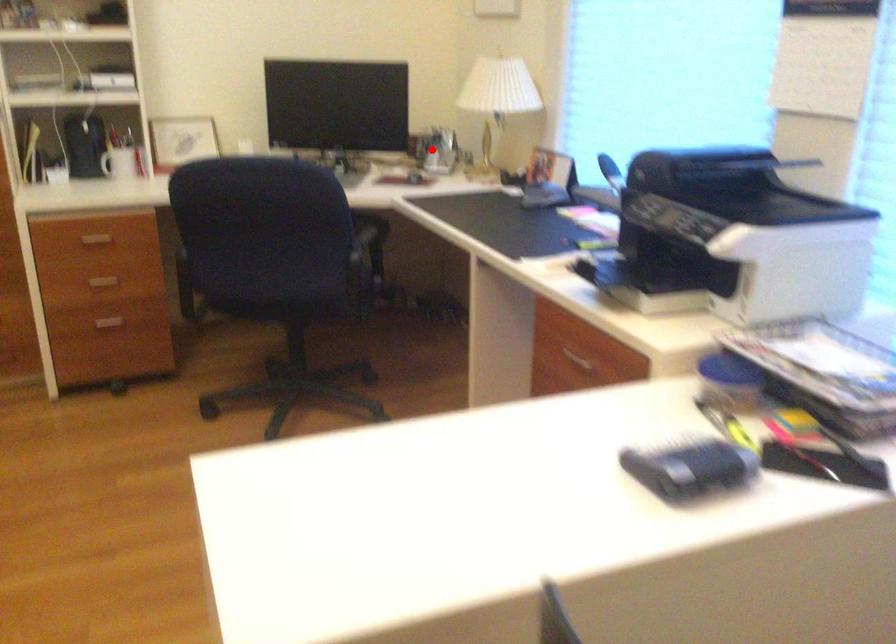
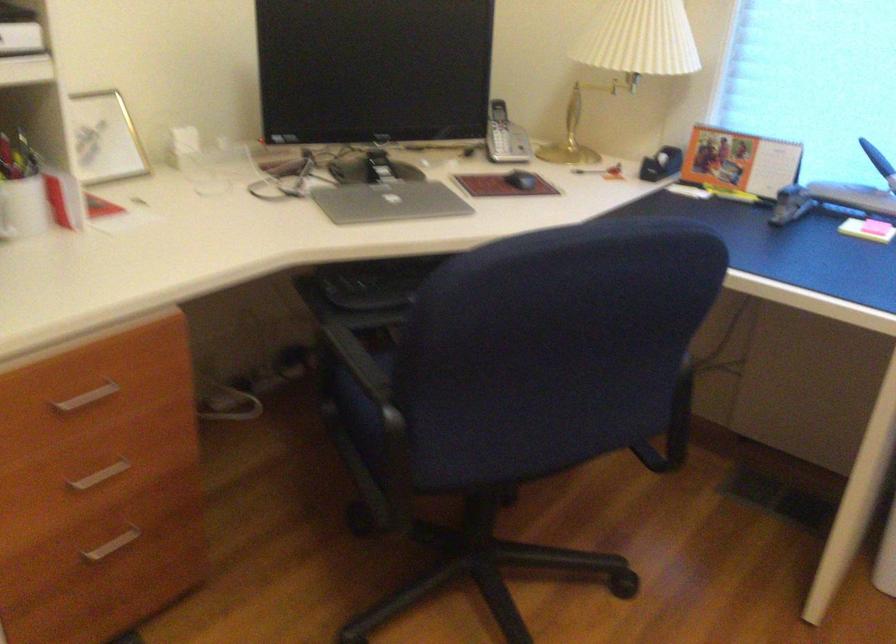
Question: I am providing you with two images of the same scene from different viewpoints. Given a red point in image1, look at the same physical point in image2. Is it:

Choices:
 (A) Closer to the viewpoint
 (B) Farther from the viewpoint

Answer: (A)